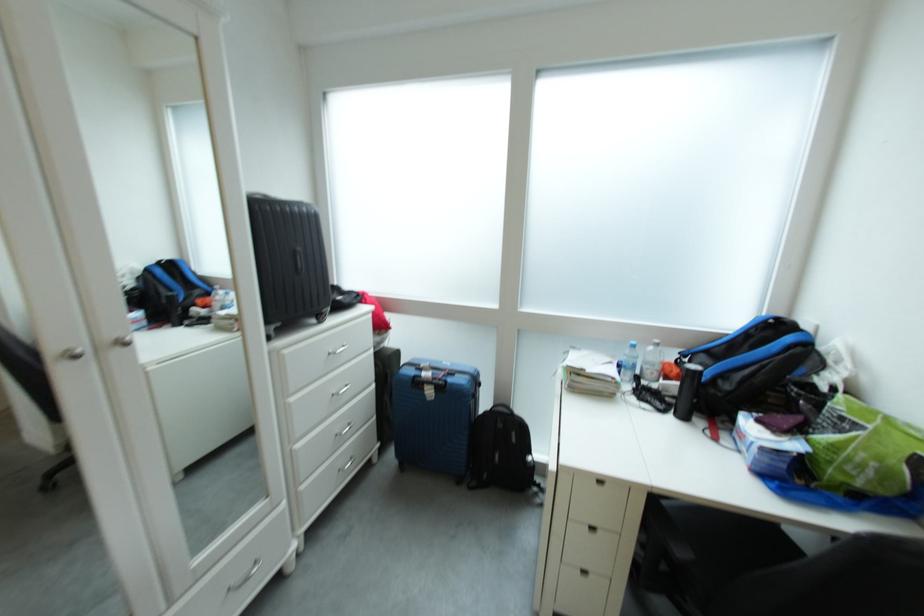
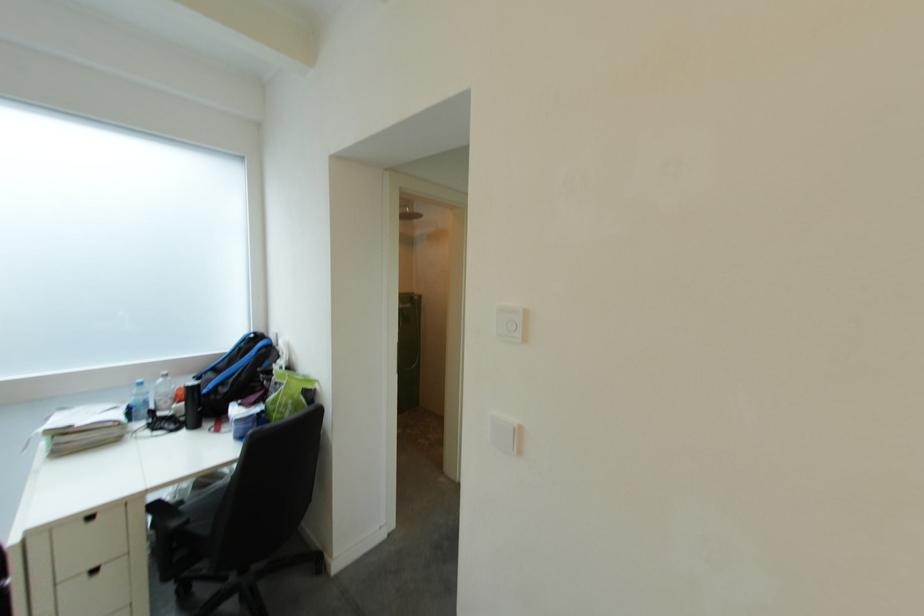
Where in the second image is the point corresponding to pixel 679 403 from the first image?

(195, 422)